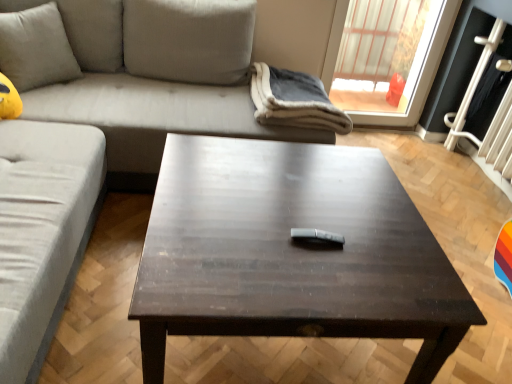
This screenshot has height=384, width=512. In order to click on vacant area to the right of satin silver remote at center in this screenshot , I will do `click(372, 249)`.